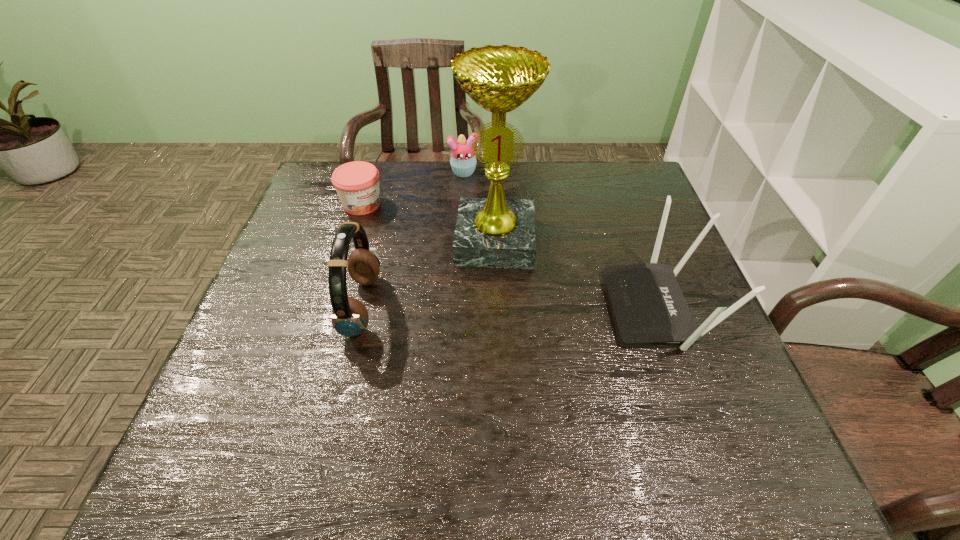
Identify the location of free spot located 0.080m on the face of the farthest object. Image resolution: width=960 pixels, height=540 pixels. click(469, 194).

The image size is (960, 540). Find the location of `jam situated at the far edge`. jam situated at the far edge is located at coordinates (357, 183).

The height and width of the screenshot is (540, 960). What are the coordinates of `cupcake that is at the far edge` in the screenshot? It's located at (463, 162).

At what (x,y) coordinates should I click in order to perform the action: click on object that is at the left edge. Please return your answer as a coordinate pair (x, y). Looking at the image, I should click on (357, 183).

Image resolution: width=960 pixels, height=540 pixels. I want to click on object positioned at the right edge, so click(x=649, y=307).

Locate an element on the screen. The width and height of the screenshot is (960, 540). object positioned at the far left corner is located at coordinates (357, 183).

In the image, there is a desktop. What are the coordinates of `vacant region at the far edge` in the screenshot? It's located at (460, 186).

Identify the location of vacant space at the near edge. The image size is (960, 540). (664, 407).

Find the location of a particular element. vacant point at the left edge is located at coordinates (318, 230).

In the image, there is a desktop. At what (x,y) coordinates should I click in order to perform the action: click on free space at the right edge. Please return your answer as a coordinate pair (x, y). Looking at the image, I should click on (728, 357).